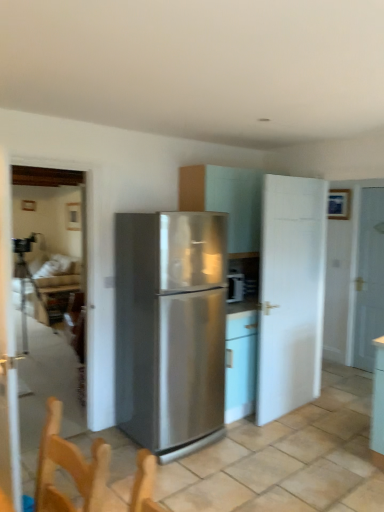
Where is `transparent glass door at left, which is the first glass door from front to back`? transparent glass door at left, which is the first glass door from front to back is located at coordinates (8, 350).

The image size is (384, 512). What do you see at coordinates (171, 329) in the screenshot?
I see `stainless steel refrigerator at center` at bounding box center [171, 329].

Measure the distance between clear glass door at left, the 1th glass door viewed from the back, and camera.

A distance of 5.51 meters exists between clear glass door at left, the 1th glass door viewed from the back, and camera.

Where is `transparent glass door at left, positioned as the second glass door in back-to-front order`? transparent glass door at left, positioned as the second glass door in back-to-front order is located at coordinates (8, 350).

From the image's perspective, is matte white cabinet at center positioned above or below transparent glass door at left, which is the first glass door from front to back?

From the image's perspective, matte white cabinet at center appears above transparent glass door at left, which is the first glass door from front to back.

The image size is (384, 512). I want to click on glass door that is the 1st one when counting downward from the matte white cabinet at center (from the image's perspective), so click(x=8, y=350).

Is point (242, 202) less distant than point (3, 281)?

No, it is behind (3, 281).

Which object is closer to the camera taking this photo, matte white cabinet at center or transparent glass door at left, positioned as the second glass door in back-to-front order?

Positioned in front is transparent glass door at left, positioned as the second glass door in back-to-front order.

Which of these two, transparent glass door at left, which is the first glass door from front to back, or stainless steel refrigerator at center, is wider?

With larger width is stainless steel refrigerator at center.

From a real-world perspective, which object rests below the other?

stainless steel refrigerator at center is physically lower.

Between transparent glass door at left, positioned as the second glass door in back-to-front order, and stainless steel refrigerator at center, which one has larger size?

stainless steel refrigerator at center.

Consider the image. What's the angular difference between transparent glass door at left, which is the first glass door from front to back, and stainless steel refrigerator at center's facing directions?

The facing directions of transparent glass door at left, which is the first glass door from front to back, and stainless steel refrigerator at center are 89.6 degrees apart.

From a real-world perspective, which is physically below, white matte door at right, placed as the 1th door when sorted from back to front, or white matte door at center-right, placed as the first door when sorted from left to right?

white matte door at center-right, placed as the first door when sorted from left to right.

From the picture: How much distance is there between white matte door at right, the first door from the right, and white matte door at center-right, which is the second door in right-to-left order?

white matte door at right, the first door from the right, is 1.27 meters away from white matte door at center-right, which is the second door in right-to-left order.

Consider the image. Can you confirm if white matte door at right, which is the second door from front to back, is wider than white matte door at center-right, acting as the 1th door starting from the front?

No.

Is point (365, 319) behind point (266, 179)?

Yes, it is behind point (266, 179).

From the image's perspective, is transparent glass door at left, positioned as the second glass door in back-to-front order, above or below wooden table at lower left?

From the image's perspective, transparent glass door at left, positioned as the second glass door in back-to-front order, appears above wooden table at lower left.

Which object is further away from the camera, transparent glass door at left, positioned as the second glass door in back-to-front order, or wooden table at lower left?

wooden table at lower left is further away from the camera.

Between point (6, 418) and point (57, 317), which one is positioned in front?

The point (6, 418) is closer to the camera.

Can you confirm if white matte door at right, placed as the 1th door when sorted from back to front, is wider than matte white cabinet at center?

No, white matte door at right, placed as the 1th door when sorted from back to front, is not wider than matte white cabinet at center.

Considering the relative sizes of white matte door at right, which is the second door from front to back, and matte white cabinet at center in the image provided, is white matte door at right, which is the second door from front to back, smaller than matte white cabinet at center?

Correct, white matte door at right, which is the second door from front to back, occupies less space than matte white cabinet at center.

Is white matte door at right, placed as the 1th door when sorted from back to front, facing away from matte white cabinet at center?

No.

Is point (368, 296) farther from viewer compared to point (247, 184)?

Yes, point (368, 296) is behind point (247, 184).

At what (x,y) coordinates should I click in order to perform the action: click on table below the transparent glass door at left, which is the first glass door from front to back (from a real-world perspective). Please return your answer as a coordinate pair (x, y). Looking at the image, I should click on (55, 300).

Considering the relative positions of wooden table at lower left and transparent glass door at left, positioned as the second glass door in back-to-front order, in the image provided, is wooden table at lower left to the right of transparent glass door at left, positioned as the second glass door in back-to-front order, from the viewer's perspective?

No.

Is wooden table at lower left smaller than transparent glass door at left, which is the first glass door from front to back?

Incorrect, wooden table at lower left is not smaller in size than transparent glass door at left, which is the first glass door from front to back.

From the image's perspective, is wooden table at lower left located beneath transparent glass door at left, positioned as the second glass door in back-to-front order?

Correct, wooden table at lower left appears lower than transparent glass door at left, positioned as the second glass door in back-to-front order, in the image.

Is wooden table at lower left positioned with its back to matte white cabinet at center?

No, wooden table at lower left's orientation is not away from matte white cabinet at center.

Which is farther, (46, 308) or (201, 200)?

The point (46, 308) is farther from the camera.

From a real-world perspective, between wooden table at lower left and matte white cabinet at center, who is vertically lower?

In real-world perspective, wooden table at lower left is lower.

You are a GUI agent. You are given a task and a screenshot of the screen. Output one action in this format:
    pyautogui.click(x=<x>, y=<y>)
    Task: Click on the cabinetry that is on the right side of transparent glass door at left, positioned as the second glass door in back-to-front order
    
    Given the screenshot: What is the action you would take?
    pyautogui.click(x=226, y=201)

From a real-world perspective, which glass door is the 2nd one above the stainless steel refrigerator at center? Please provide its 2D coordinates.

[(8, 350)]

From the image, which object appears to be farther from transparent glass door at left, which is the first glass door from front to back, wooden table at lower left or white matte door at right, which is the second door from front to back?

wooden table at lower left is further to transparent glass door at left, which is the first glass door from front to back.

Considering their positions, is white matte door at right, the second door viewed from the left, positioned further to matte white cabinet at center than clear glass door at left, which ranks as the 2th glass door in front-to-back order?

Based on the image, clear glass door at left, which ranks as the 2th glass door in front-to-back order, appears to be further to matte white cabinet at center.

From the image, which object appears to be nearer to clear glass door at left, which ranks as the 2th glass door in front-to-back order, transparent glass door at left, which is the first glass door from front to back, or wooden table at lower left?

wooden table at lower left is positioned closer to the anchor clear glass door at left, which ranks as the 2th glass door in front-to-back order.

Looking at the image, which one is located further to matte white cabinet at center, white matte door at center-right, placed as the first door when sorted from left to right, or transparent glass door at left, which is the first glass door from front to back?

transparent glass door at left, which is the first glass door from front to back, is positioned further to the anchor matte white cabinet at center.

From the image, which object appears to be farther from transparent glass door at left, positioned as the second glass door in back-to-front order, white matte door at right, placed as the 1th door when sorted from back to front, or clear glass door at left, which ranks as the 2th glass door in front-to-back order?

clear glass door at left, which ranks as the 2th glass door in front-to-back order, lies further to transparent glass door at left, positioned as the second glass door in back-to-front order, than the other object.

From the image, which object appears to be farther from matte white cabinet at center, clear glass door at left, which ranks as the 2th glass door in front-to-back order, or stainless steel refrigerator at center?

Among the two, clear glass door at left, which ranks as the 2th glass door in front-to-back order, is located further to matte white cabinet at center.

Estimate the real-world distances between objects in this image. Which object is closer to white matte door at center-right, placed as the first door when sorted from left to right, matte white cabinet at center or wooden table at lower left?

The object closer to white matte door at center-right, placed as the first door when sorted from left to right, is matte white cabinet at center.

When comparing their distances from matte white cabinet at center, does wooden table at lower left or white matte door at right, placed as the 1th door when sorted from back to front, seem closer?

white matte door at right, placed as the 1th door when sorted from back to front, is closer to matte white cabinet at center.

Locate an element on the screen. Image resolution: width=384 pixels, height=512 pixels. refrigerator positioned between transparent glass door at left, positioned as the second glass door in back-to-front order, and matte white cabinet at center from near to far is located at coordinates (171, 329).

The width and height of the screenshot is (384, 512). In order to click on glass door between transparent glass door at left, which is the first glass door from front to back, and stainless steel refrigerator at center from left to right in this screenshot , I will do `click(49, 245)`.

I want to click on glass door positioned between transparent glass door at left, which is the first glass door from front to back, and wooden table at lower left from near to far, so pos(49,245).

This screenshot has height=512, width=384. Identify the location of door between clear glass door at left, which ranks as the 2th glass door in front-to-back order, and white matte door at right, placed as the 1th door when sorted from back to front. click(x=290, y=294).